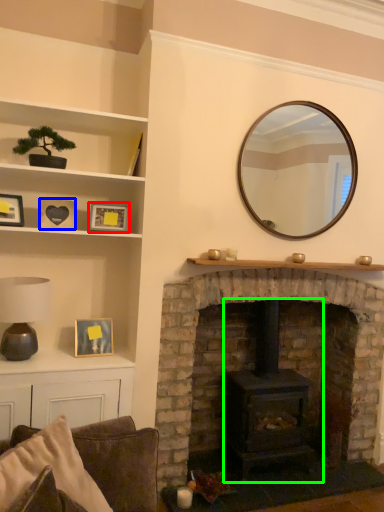
Question: Based on their relative distances, which object is farther from picture frame (highlighted by a red box)? Choose from picture frame (highlighted by a blue box) and wood burning stove (highlighted by a green box).

Choices:
 (A) picture frame
 (B) wood burning stove

Answer: (B)